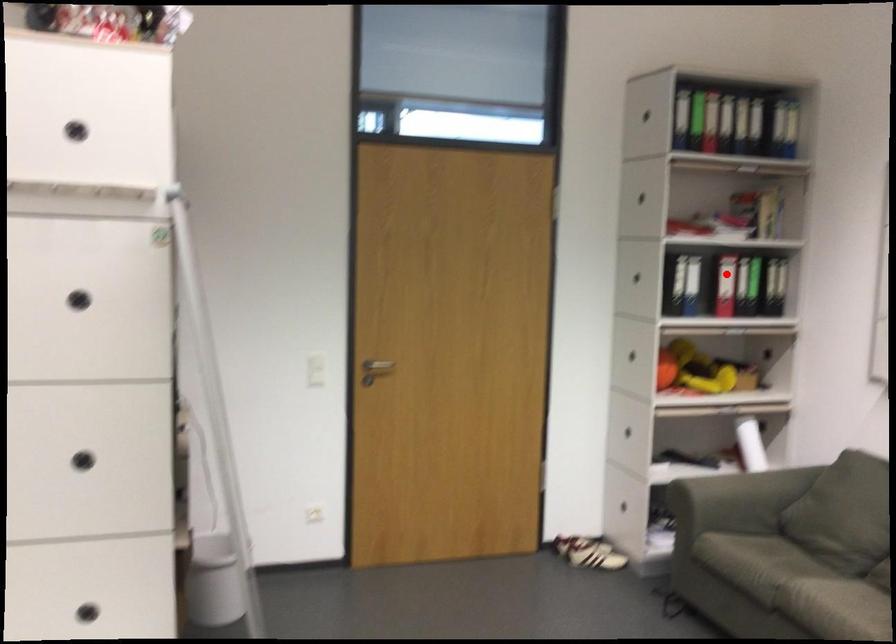
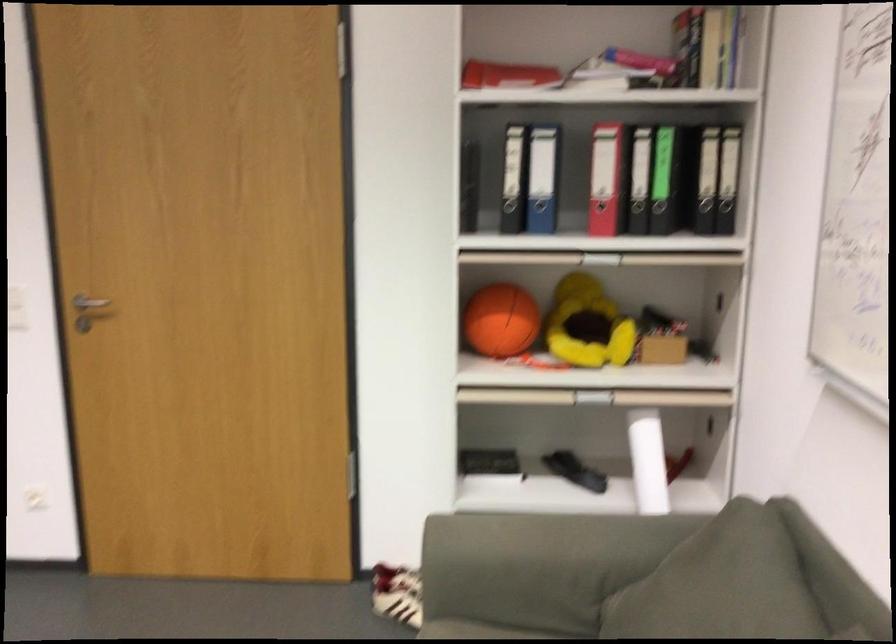
Question: I am providing you with two images of the same scene from different viewpoints. Given a red point in image1, look at the same physical point in image2. Is it:

Choices:
 (A) Closer to the viewpoint
 (B) Farther from the viewpoint

Answer: (A)